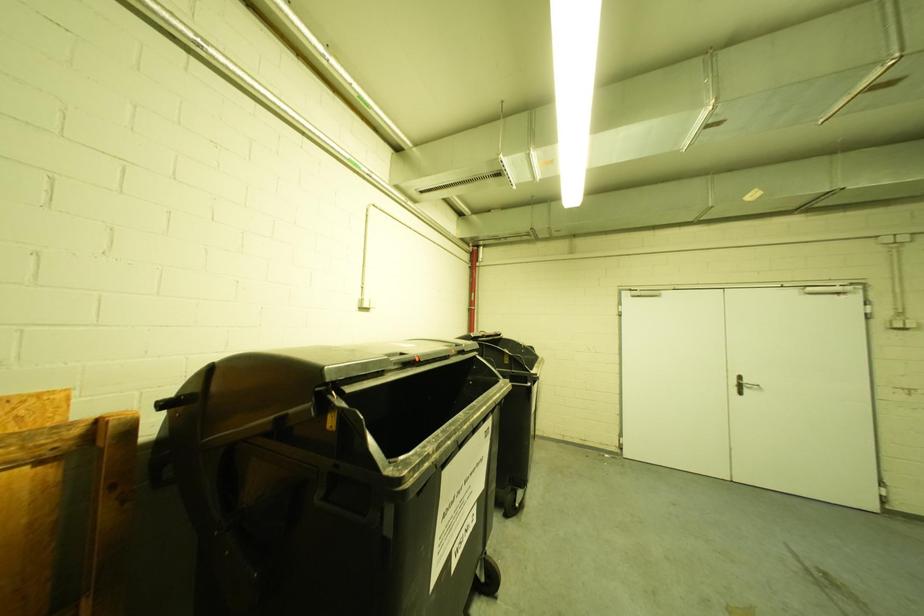
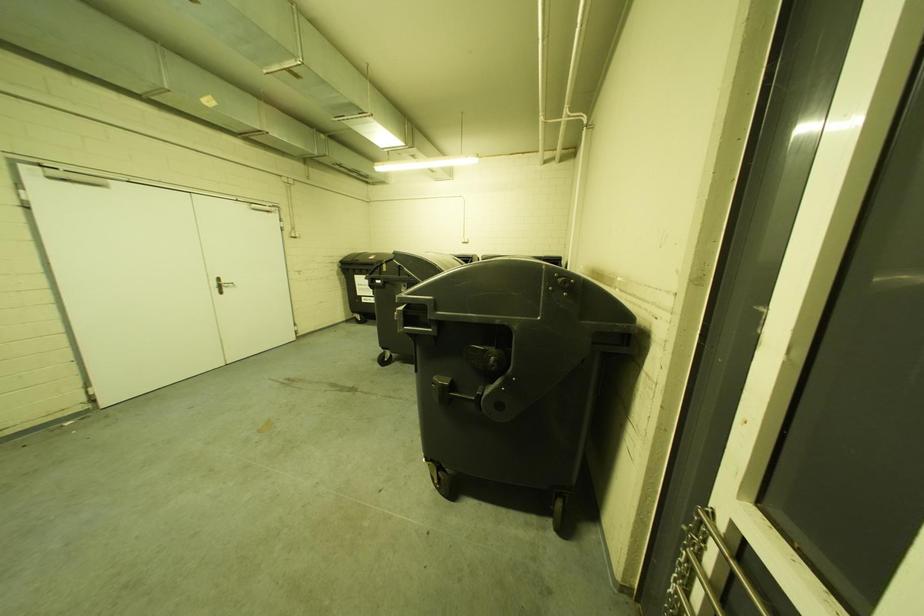
Question: How did the camera likely rotate?

Choices:
 (A) Left
 (B) Right
 (C) Up
 (D) Down

Answer: (B)